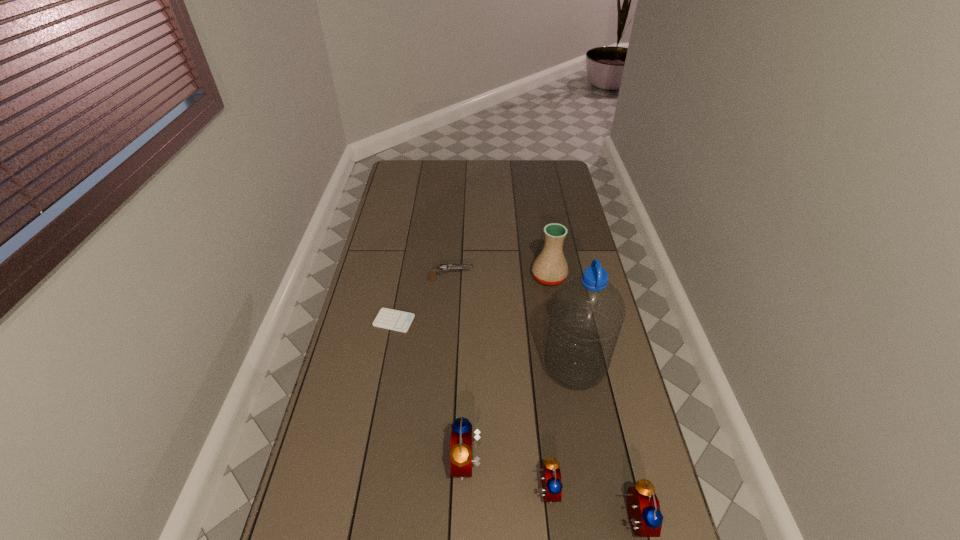
Image resolution: width=960 pixels, height=540 pixels. Find the location of `water jug present at the right edge`. water jug present at the right edge is located at coordinates (587, 314).

I want to click on vacant region at the far edge of the desktop, so click(493, 171).

The height and width of the screenshot is (540, 960). In the image, there is a desktop. Identify the location of vacant space at the left edge. (414, 221).

Find the location of a particular element. Image resolution: width=960 pixels, height=540 pixels. free region at the right edge of the desktop is located at coordinates (555, 188).

This screenshot has width=960, height=540. In order to click on vacant space at the far left corner in this screenshot , I will do `click(406, 169)`.

This screenshot has width=960, height=540. In order to click on free space at the far right corner of the desktop in this screenshot , I will do `click(563, 184)`.

At what (x,y) coordinates should I click in order to perform the action: click on unoccupied position between the shortest object and the shortest alarm clock. Please return your answer as a coordinate pair (x, y). The height and width of the screenshot is (540, 960). Looking at the image, I should click on (470, 406).

Find the location of a particular element. free point between the water jug and the shortest alarm clock is located at coordinates (561, 429).

I want to click on free space that is in between the pottery and the second shortest object, so click(x=500, y=278).

At what (x,y) coordinates should I click in order to perform the action: click on empty space between the leftmost alarm clock and the gun. Please return your answer as a coordinate pair (x, y). The width and height of the screenshot is (960, 540). Looking at the image, I should click on (459, 371).